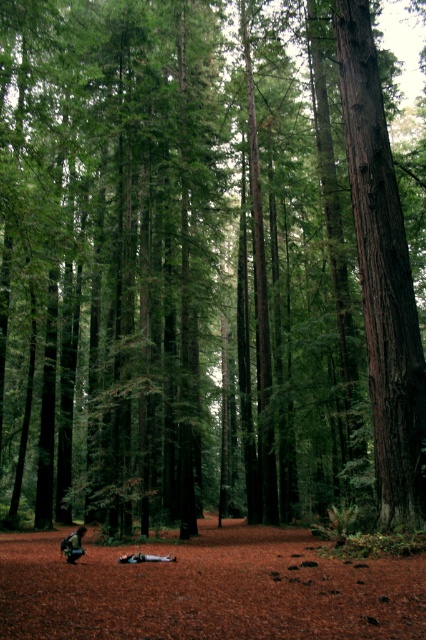
You are hiking in the forest and see a dark green fabric backpack at lower left and a light blue fabric at lower center. Which item is nearer to you?

The dark green fabric backpack at lower left is closer to the viewer than the light blue fabric at lower center.

You are standing in the forest scene described. You need to locate the dark green fabric backpack at lower left. Where exactly is it positioned in terms of coordinates?

The dark green fabric backpack at lower left is positioned at coordinates point (72, 545).